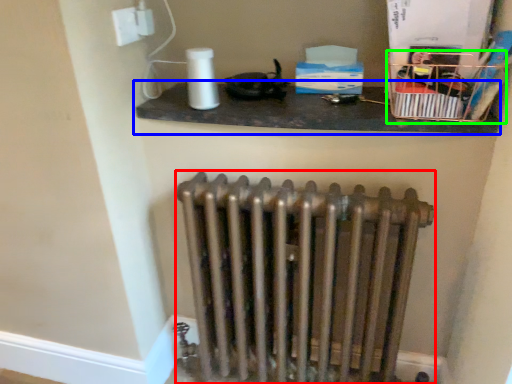
Question: Which object is positioned farthest from radiator (highlighted by a red box)? Select from shelf (highlighted by a blue box) and crate (highlighted by a green box).

Choices:
 (A) shelf
 (B) crate

Answer: (B)